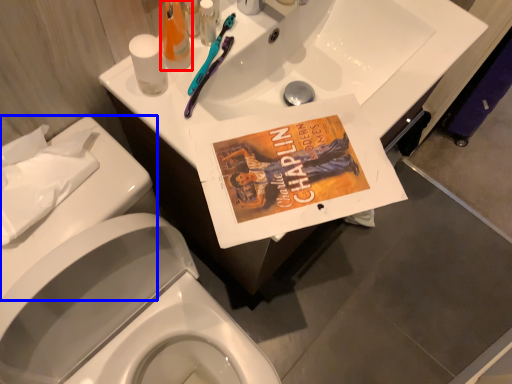
Question: Which object appears farthest to the camera in this image, mouthwash (highlighted by a red box) or porcelain (highlighted by a blue box)?

Choices:
 (A) mouthwash
 (B) porcelain

Answer: (A)